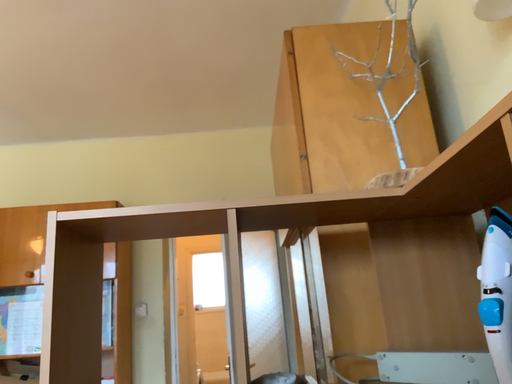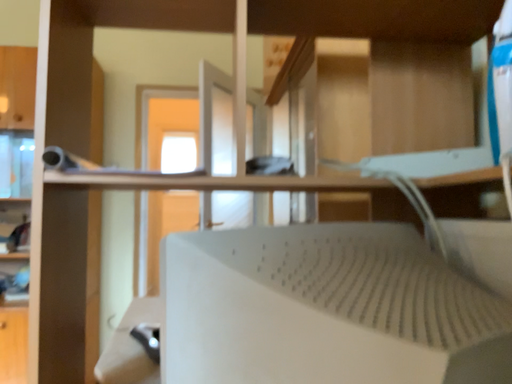
Question: How did the camera likely rotate when shooting the video?

Choices:
 (A) rotated downward
 (B) rotated upward

Answer: (A)